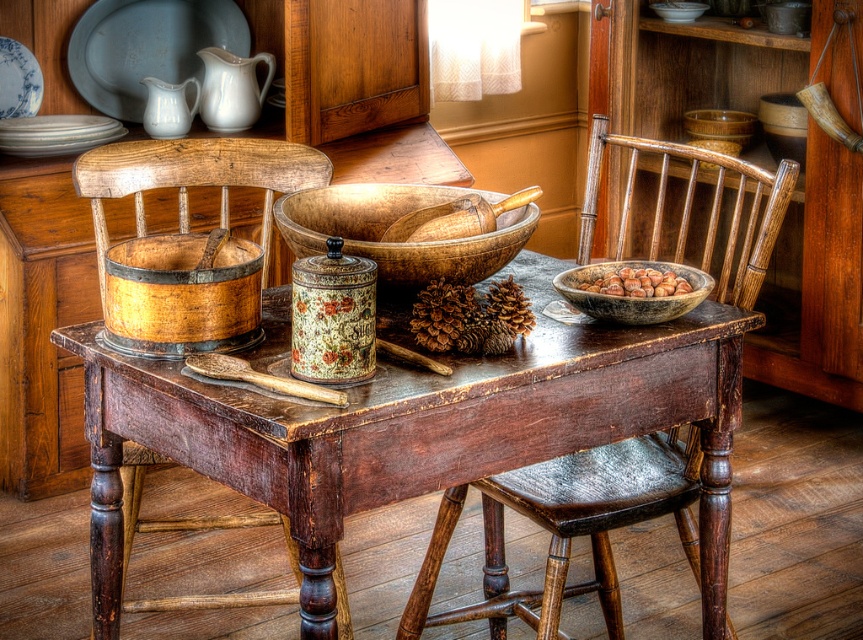
Question: Does wooden chair at center appear on the left side of wooden bowl at center?

Choices:
 (A) no
 (B) yes

Answer: (A)

Question: Can you confirm if wooden bowl filled with nuts at center is positioned above matte white bowl at upper center?

Choices:
 (A) yes
 (B) no

Answer: (B)

Question: Which object is positioned farthest from the wooden bowl filled with nuts at center?

Choices:
 (A) wooden chair at left
 (B) brown matte bowl at center
 (C) wooden table at center

Answer: (A)

Question: Is matte white plate at upper left bigger than wooden bowl filled with nuts at center?

Choices:
 (A) no
 (B) yes

Answer: (B)

Question: Which object appears closest to the camera in this image?

Choices:
 (A) wooden chair at left
 (B) white ceramic pitcher at upper left
 (C) matte white bowl at upper center
 (D) wooden chair at center

Answer: (A)

Question: Which point is farther to the camera?

Choices:
 (A) (186, 19)
 (B) (515, 228)

Answer: (A)